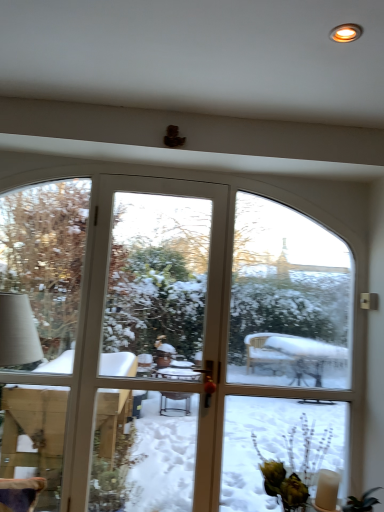
Question: Is clear glass screen door at center at the left side of green leafy plant at lower right?

Choices:
 (A) no
 (B) yes

Answer: (A)

Question: From a real-world perspective, is clear glass screen door at center below green leafy plant at lower right?

Choices:
 (A) no
 (B) yes

Answer: (A)

Question: Is clear glass screen door at center thinner than green leafy plant at lower right?

Choices:
 (A) no
 (B) yes

Answer: (B)

Question: From a real-world perspective, is clear glass screen door at center located higher than green leafy plant at lower right?

Choices:
 (A) yes
 (B) no

Answer: (A)

Question: Is clear glass screen door at center aimed at green leafy plant at lower right?

Choices:
 (A) yes
 (B) no

Answer: (A)

Question: Looking at their shapes, would you say matte gold light at upper right is wider or thinner than clear glass screen door at center?

Choices:
 (A) wide
 (B) thin

Answer: (A)

Question: Relative to clear glass screen door at center, is matte gold light at upper right in front or behind?

Choices:
 (A) front
 (B) behind

Answer: (A)

Question: Is matte gold light at upper right to the left or to the right of clear glass screen door at center in the image?

Choices:
 (A) right
 (B) left

Answer: (B)

Question: Does point (347, 26) appear closer or farther from the camera than point (261, 400)?

Choices:
 (A) farther
 (B) closer

Answer: (B)

Question: From their relative heights in the image, would you say matte gold light at upper right is taller or shorter than green leafy plant at lower right?

Choices:
 (A) tall
 (B) short

Answer: (B)

Question: From the image's perspective, is matte gold light at upper right positioned above or below green leafy plant at lower right?

Choices:
 (A) below
 (B) above

Answer: (B)

Question: Considering the positions of point (354, 29) and point (302, 494), is point (354, 29) closer or farther from the camera than point (302, 494)?

Choices:
 (A) farther
 (B) closer

Answer: (B)

Question: Is matte gold light at upper right in front of or behind green leafy plant at lower right in the image?

Choices:
 (A) front
 (B) behind

Answer: (A)

Question: From a real-world perspective, is clear glass screen door at center above or below green leafy plant at lower right?

Choices:
 (A) below
 (B) above

Answer: (B)

Question: Is clear glass screen door at center inside or outside of green leafy plant at lower right?

Choices:
 (A) outside
 (B) inside

Answer: (A)